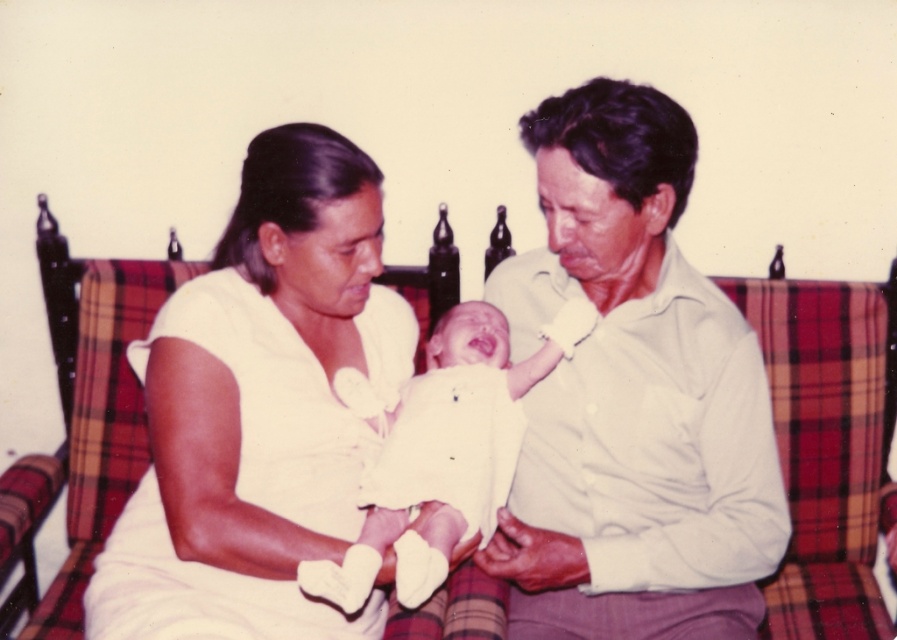
You are a photographer setting up a photo shoot with the scene described. You need to ensure that the white fabric dress at center and the white soft fabric baby at center are both visible in the frame. Given their sizes, which object should you prioritize positioning closer to the camera to maintain clarity?

The white fabric dress at center is much taller than the white soft fabric baby at center, so you should position the white soft fabric baby at center closer to the camera to ensure both are visible and clear in the frame.

You are standing at the point marked by the coordinate point at point (x=637, y=576). You want to reach the baby who is 3.82 feet away from you. How many steps would it take you to reach the baby if each step covers 1.5 feet?

The distance between you and the baby is 3.82 feet. Since each step covers 1.5 feet, you would need approximately 3 steps to reach the baby.